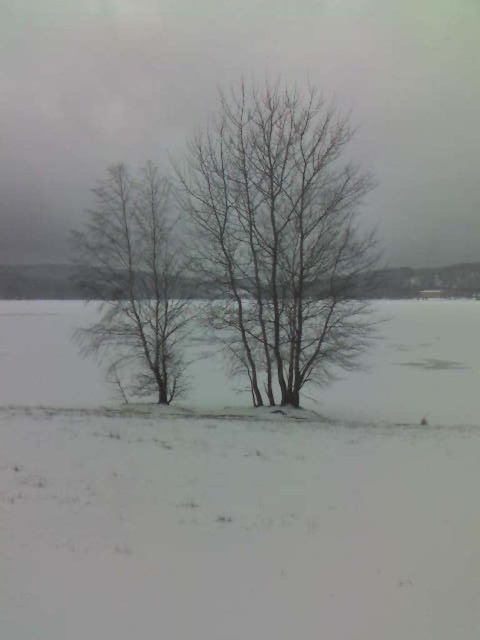
You are an artist sketching the winter landscape. You want to draw the bare branches at center precisely. According to the coordinates provided, where exactly should you place them on your canvas?

The bare branches at center should be placed at coordinates point (278, 237) on the canvas.

You are an observer standing in the winter landscape described. You notice the white powdery snow at center and the bare branches at center. Which object covers a bigger area in the scene?

The white powdery snow at center is larger in size than the bare branches at center, so the white powdery snow at center covers a bigger area in the scene.

You are an observer standing in the winter landscape. You notice the white powdery snow at center and the bare branches at left. Which of these two objects occupies a larger area in the image?

The white powdery snow at center occupies a larger area than the bare branches at left according to the description.